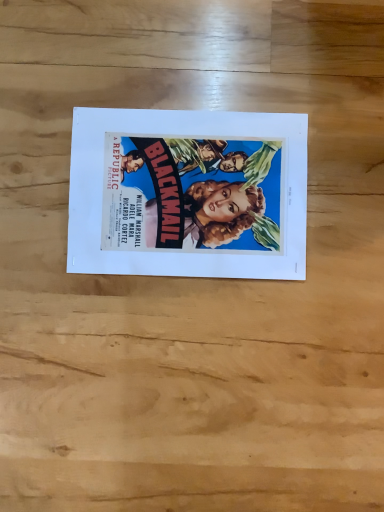
At what (x,y) coordinates should I click in order to perform the action: click on free space above matte paper poster at center (from a real-world perspective). Please return your answer as a coordinate pair (x, y). Looking at the image, I should click on (192, 187).